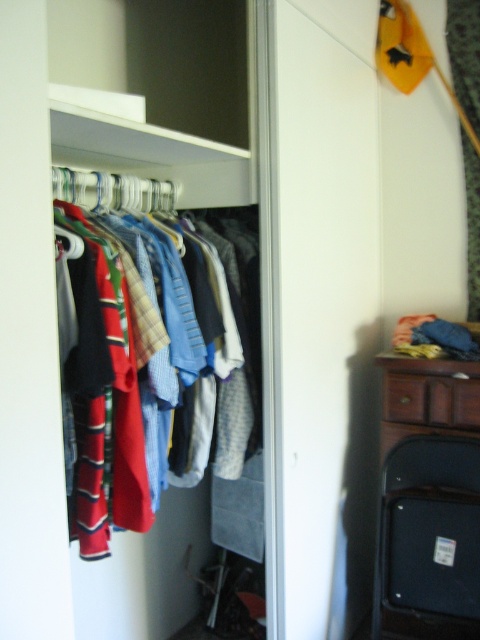
You are organizing your closet and notice two items in the image. One is the white fabric curtain at upper right and the other is the metallic silver hanger at center. Which item is positioned higher in the closet?

The white fabric curtain at upper right is positioned higher than the metallic silver hanger at center.

You are organizing your closet and see the multicolored fabric shirts at center and the brown wood drawer at right. Which item is located to the left of the other?

The multicolored fabric shirts at center are positioned to the left of the brown wood drawer at right.